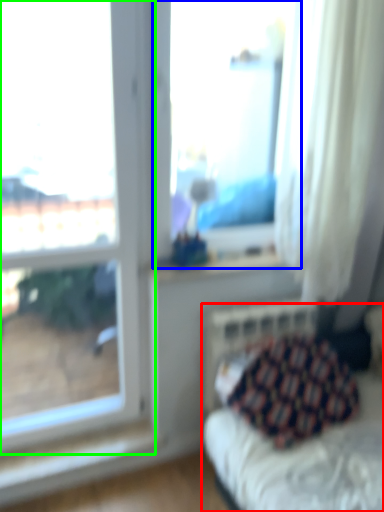
Question: Which object is positioned farthest from furniture (highlighted by a red box)? Select from window (highlighted by a blue box) and window (highlighted by a green box).

Choices:
 (A) window
 (B) window

Answer: (A)